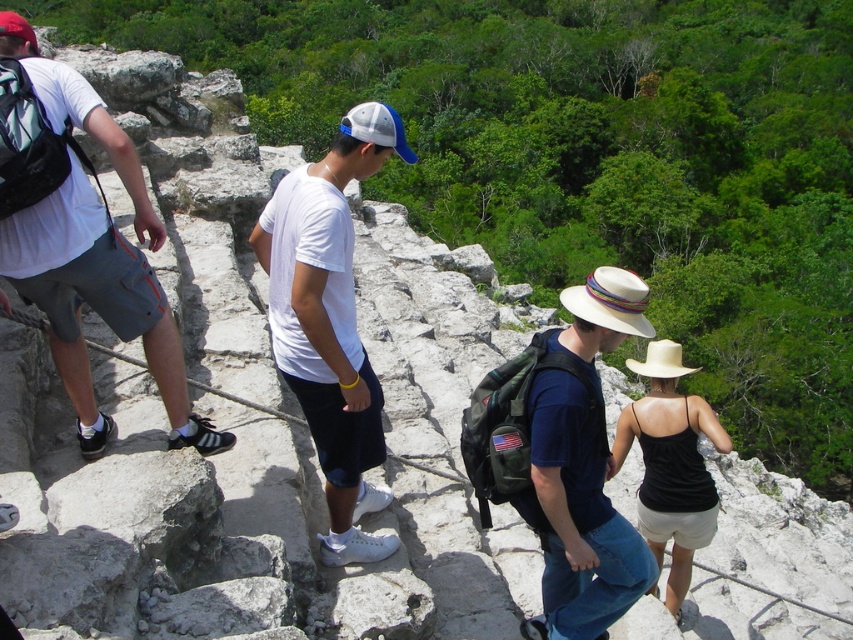
Question: Is white t-shirt at left to the left of white matte t-shirt at center from the viewer's perspective?

Choices:
 (A) no
 (B) yes

Answer: (B)

Question: Is white t-shirt at left to the left of white matte t-shirt at center from the viewer's perspective?

Choices:
 (A) yes
 (B) no

Answer: (A)

Question: Does white t-shirt at left appear on the right side of white matte t-shirt at center?

Choices:
 (A) no
 (B) yes

Answer: (A)

Question: Among these objects, which one is farthest from the camera?

Choices:
 (A) white t-shirt at left
 (B) white matte t-shirt at center

Answer: (B)